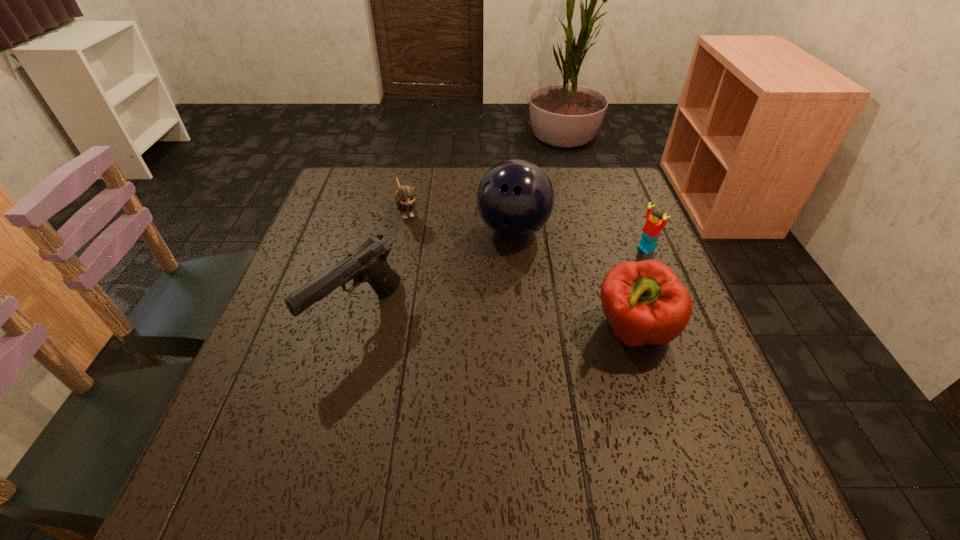
This screenshot has width=960, height=540. I want to click on vacant region located 0.080m on the front-facing side of the kitten, so click(x=418, y=245).

Image resolution: width=960 pixels, height=540 pixels. I want to click on free spot located 0.160m on the front-facing side of the kitten, so click(426, 265).

The image size is (960, 540). Find the location of `vacant region located on the front-facing side of the kitten`. vacant region located on the front-facing side of the kitten is located at coordinates (436, 287).

Where is `vacant space located on the surface of the bowling ball near the finger holes`? Image resolution: width=960 pixels, height=540 pixels. vacant space located on the surface of the bowling ball near the finger holes is located at coordinates (523, 295).

Identify the location of vacant region located 0.220m on the surface of the bowling ball near the finger holes. Image resolution: width=960 pixels, height=540 pixels. (528, 323).

Locate an element on the screen. free space located 0.360m on the surface of the bowling ball near the finger holes is located at coordinates (537, 380).

What are the coordinates of `kitten that is positioned at the far edge` in the screenshot? It's located at (405, 200).

Image resolution: width=960 pixels, height=540 pixels. In order to click on bowling ball located in the far edge section of the desktop in this screenshot , I will do `click(515, 198)`.

This screenshot has width=960, height=540. I want to click on object positioned at the left edge, so click(367, 263).

Identify the location of bell pepper present at the right edge. The width and height of the screenshot is (960, 540). (646, 303).